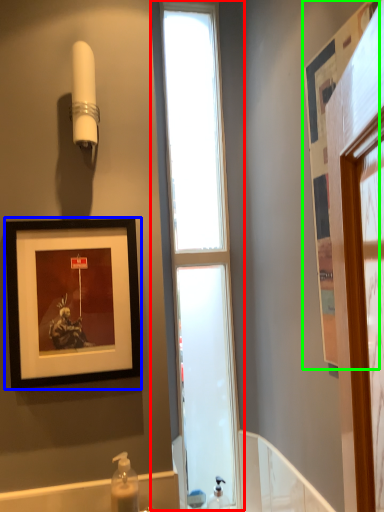
Question: Considering the real-world distances, which object is farthest from window (highlighted by a red box)? picture frame (highlighted by a blue box) or picture frame (highlighted by a green box)?

Choices:
 (A) picture frame
 (B) picture frame

Answer: (B)